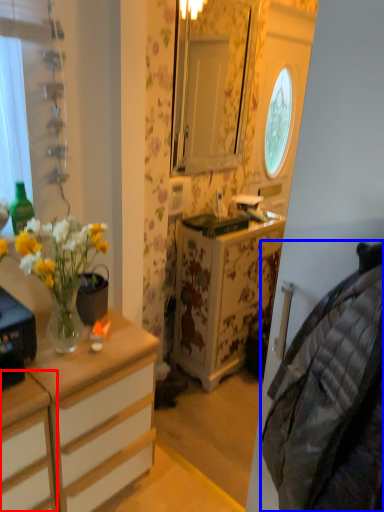
Question: Which of the following is the farthest to the observer, cabinetry (highlighted by a red box) or material (highlighted by a blue box)?

Choices:
 (A) cabinetry
 (B) material

Answer: (A)